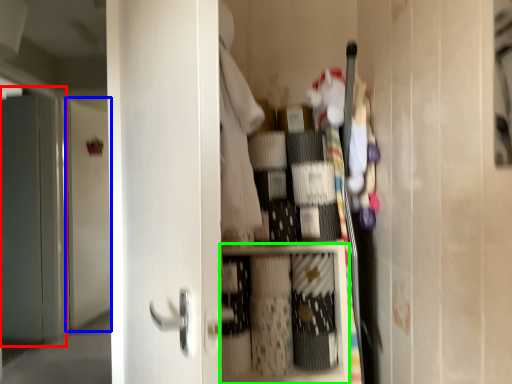
Question: Which object is positioned closest to screen door (highlighted by a red box)? Select from door (highlighted by a blue box) and cabinet (highlighted by a green box).

Choices:
 (A) door
 (B) cabinet

Answer: (A)